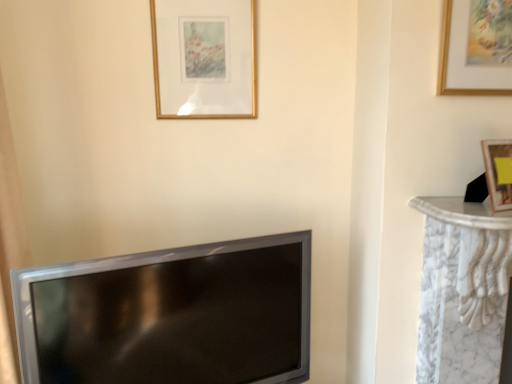
Question: Can you confirm if gold wooden picture frame at upper center, placed as the 2th picture frame when sorted from front to back, is smaller than matte black tv at lower left?

Choices:
 (A) no
 (B) yes

Answer: (B)

Question: Are gold wooden picture frame at upper center, which is the first picture frame from left to right, and matte black tv at lower left located far from each other?

Choices:
 (A) yes
 (B) no

Answer: (B)

Question: From a real-world perspective, is gold wooden picture frame at upper center, positioned as the first picture frame in back-to-front order, over matte black tv at lower left?

Choices:
 (A) yes
 (B) no

Answer: (A)

Question: Does gold wooden picture frame at upper center, placed as the 2th picture frame when sorted from front to back, contain matte black tv at lower left?

Choices:
 (A) yes
 (B) no

Answer: (B)

Question: Is gold wooden picture frame at upper center, which ranks as the 2th picture frame in right-to-left order, at the left side of matte black tv at lower left?

Choices:
 (A) yes
 (B) no

Answer: (B)

Question: In the image, is gold wooden picture frame at upper center, positioned as the first picture frame in back-to-front order, positioned in front of or behind matte black tv at lower left?

Choices:
 (A) front
 (B) behind

Answer: (B)

Question: From a real-world perspective, is gold wooden picture frame at upper center, positioned as the first picture frame in back-to-front order, above or below matte black tv at lower left?

Choices:
 (A) below
 (B) above

Answer: (B)

Question: Do you think gold wooden picture frame at upper center, placed as the 2th picture frame when sorted from front to back, is within matte black tv at lower left, or outside of it?

Choices:
 (A) outside
 (B) inside

Answer: (A)

Question: From their relative heights in the image, would you say gold wooden picture frame at upper center, which is the first picture frame from left to right, is taller or shorter than matte black tv at lower left?

Choices:
 (A) tall
 (B) short

Answer: (B)

Question: Is gold wooden picture frame at upper center, placed as the 2th picture frame when sorted from front to back, inside or outside of gold wooden picture frame at upper right, the first picture frame from the front?

Choices:
 (A) outside
 (B) inside

Answer: (A)

Question: In the image, is gold wooden picture frame at upper center, placed as the 2th picture frame when sorted from front to back, on the left side or the right side of gold wooden picture frame at upper right, which is counted as the second picture frame, starting from the back?

Choices:
 (A) left
 (B) right

Answer: (A)

Question: Based on their sizes in the image, would you say gold wooden picture frame at upper center, which ranks as the 2th picture frame in right-to-left order, is bigger or smaller than gold wooden picture frame at upper right, the first picture frame from the front?

Choices:
 (A) big
 (B) small

Answer: (A)

Question: From a real-world perspective, is gold wooden picture frame at upper center, placed as the 2th picture frame when sorted from front to back, above or below gold wooden picture frame at upper right, the first picture frame from the front?

Choices:
 (A) above
 (B) below

Answer: (A)

Question: Does point (458, 43) appear closer or farther from the camera than point (181, 249)?

Choices:
 (A) closer
 (B) farther

Answer: (A)

Question: From the image's perspective, is gold wooden picture frame at upper right, which is counted as the second picture frame, starting from the back, positioned above or below matte black tv at lower left?

Choices:
 (A) below
 (B) above

Answer: (B)